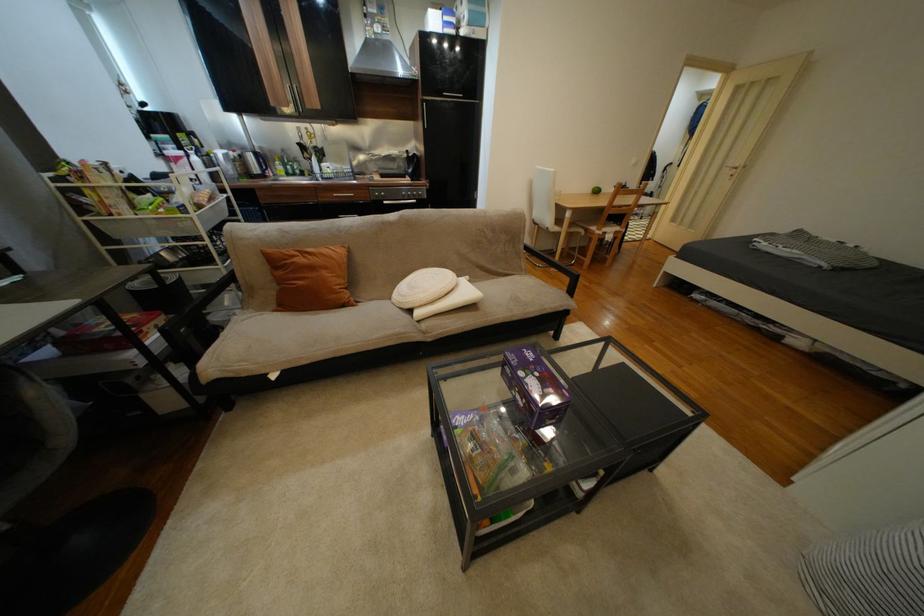
Find where to turn the silver door handle. Please return your answer as a coordinate pair (x, y).

(733, 169)